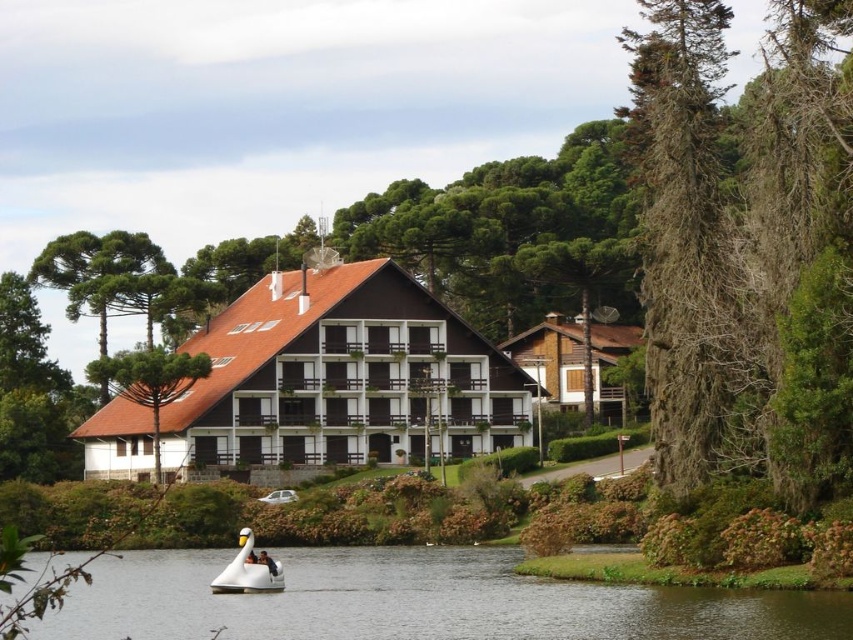
Is brown wooden house at center-right bigger than white matte swan boat at lower center?

Yes, brown wooden house at center-right is bigger than white matte swan boat at lower center.

Does brown wooden house at center-right appear on the left side of white matte swan boat at lower center?

In fact, brown wooden house at center-right is to the right of white matte swan boat at lower center.

Is point (520, 337) positioned after point (254, 554)?

Yes, it is behind point (254, 554).

This screenshot has width=853, height=640. I want to click on brown wooden house at center-right, so click(x=575, y=362).

Does brown wood hotel at center come behind white glossy water at lower center?

Yes, brown wood hotel at center is further from the viewer.

Can you confirm if brown wood hotel at center is thinner than white glossy water at lower center?

Indeed, brown wood hotel at center has a lesser width compared to white glossy water at lower center.

I want to click on brown wood hotel at center, so click(323, 381).

In the scene shown: Is brown wood hotel at center taller than white matte swan boat at lower center?

Indeed, brown wood hotel at center has a greater height compared to white matte swan boat at lower center.

Between brown wood hotel at center and white matte swan boat at lower center, which one has more height?

Standing taller between the two is brown wood hotel at center.

You are a GUI agent. You are given a task and a screenshot of the screen. Output one action in this format:
    pyautogui.click(x=<x>, y=<y>)
    Task: Click on the brown wood hotel at center
    The width and height of the screenshot is (853, 640).
    Given the screenshot: What is the action you would take?
    pyautogui.click(x=323, y=381)